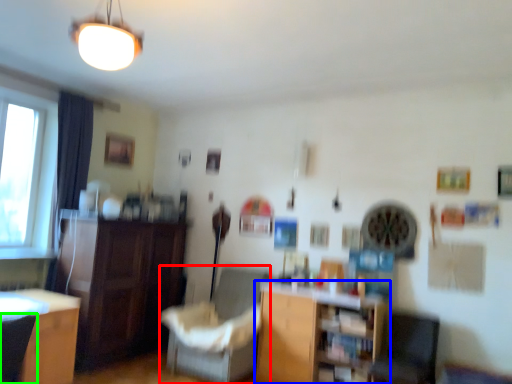
Question: Which object is positioned closest to chair (highlighted by a red box)? Select from shelf (highlighted by a blue box) and armchair (highlighted by a green box).

Choices:
 (A) shelf
 (B) armchair

Answer: (A)